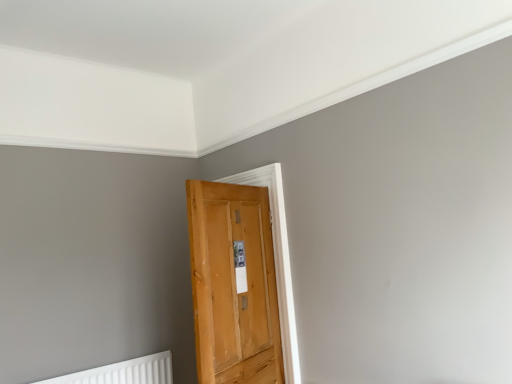
Question: Should I look upward or downward to see white plastic radiator at lower left?

Choices:
 (A) up
 (B) down

Answer: (B)

Question: Should I look upward or downward to see wooden door at center?

Choices:
 (A) up
 (B) down

Answer: (B)

Question: From the image's perspective, is white plastic radiator at lower left located beneath wooden door at center?

Choices:
 (A) no
 (B) yes

Answer: (B)

Question: Is white plastic radiator at lower left closer to camera compared to wooden door at center?

Choices:
 (A) yes
 (B) no

Answer: (B)

Question: Can you confirm if white plastic radiator at lower left is thinner than wooden door at center?

Choices:
 (A) yes
 (B) no

Answer: (A)

Question: From the image's perspective, is white plastic radiator at lower left over wooden door at center?

Choices:
 (A) no
 (B) yes

Answer: (A)

Question: Is white plastic radiator at lower left not within wooden door at center?

Choices:
 (A) no
 (B) yes

Answer: (B)

Question: Is white plastic radiator at lower left wider than wooden door at center?

Choices:
 (A) no
 (B) yes

Answer: (A)

Question: Is wooden door at center directly adjacent to white plastic radiator at lower left?

Choices:
 (A) no
 (B) yes

Answer: (A)

Question: Is wooden door at center to the right of white plastic radiator at lower left from the viewer's perspective?

Choices:
 (A) no
 (B) yes

Answer: (B)

Question: Is wooden door at center at the left side of white plastic radiator at lower left?

Choices:
 (A) yes
 (B) no

Answer: (B)

Question: From a real-world perspective, is wooden door at center physically above white plastic radiator at lower left?

Choices:
 (A) no
 (B) yes

Answer: (B)

Question: From the image's perspective, is wooden door at center on top of white plastic radiator at lower left?

Choices:
 (A) yes
 (B) no

Answer: (A)

Question: Is wooden door at center bigger than white plastic radiator at lower left?

Choices:
 (A) no
 (B) yes

Answer: (B)

Question: Considering the positions of wooden door at center and white plastic radiator at lower left in the image, is wooden door at center wider or thinner than white plastic radiator at lower left?

Choices:
 (A) wide
 (B) thin

Answer: (A)